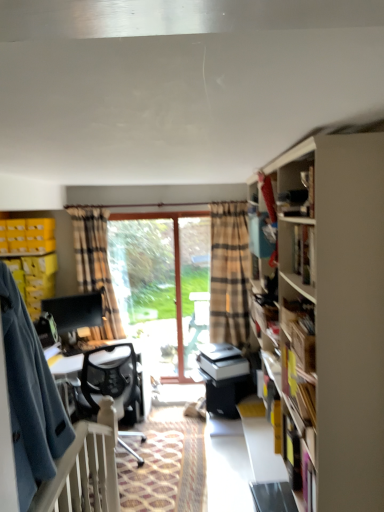
Question: Could you tell me if white plastic balustrade at lower left is facing matte black bookshelf at upper right?

Choices:
 (A) no
 (B) yes

Answer: (A)

Question: From a real-world perspective, does white plastic balustrade at lower left stand above matte black bookshelf at upper right?

Choices:
 (A) yes
 (B) no

Answer: (B)

Question: Does white plastic balustrade at lower left lie behind matte black bookshelf at upper right?

Choices:
 (A) no
 (B) yes

Answer: (A)

Question: From the image's perspective, is white plastic balustrade at lower left located beneath matte black bookshelf at upper right?

Choices:
 (A) no
 (B) yes

Answer: (B)

Question: Can you confirm if white plastic balustrade at lower left is taller than matte black bookshelf at upper right?

Choices:
 (A) no
 (B) yes

Answer: (B)

Question: Is white plastic balustrade at lower left bigger or smaller than white mesh chair at center?

Choices:
 (A) small
 (B) big

Answer: (A)

Question: In terms of width, does white plastic balustrade at lower left look wider or thinner when compared to white mesh chair at center?

Choices:
 (A) thin
 (B) wide

Answer: (A)

Question: Is white plastic balustrade at lower left taller or shorter than white mesh chair at center?

Choices:
 (A) short
 (B) tall

Answer: (A)

Question: From the image's perspective, is white plastic balustrade at lower left above or below white mesh chair at center?

Choices:
 (A) below
 (B) above

Answer: (B)

Question: Is plaid fabric curtain at center situated inside yellow plastic crate at left, the second cabinet ordered from the bottom, or outside?

Choices:
 (A) outside
 (B) inside

Answer: (A)

Question: From the image's perspective, is plaid fabric curtain at center located above or below yellow plastic crate at left, the second cabinet ordered from the bottom?

Choices:
 (A) above
 (B) below

Answer: (B)

Question: Considering the positions of plaid fabric curtain at center and yellow plastic crate at left, the second cabinet ordered from the bottom, in the image, is plaid fabric curtain at center wider or thinner than yellow plastic crate at left, the second cabinet ordered from the bottom,?

Choices:
 (A) thin
 (B) wide

Answer: (A)

Question: Considering the positions of plaid fabric curtain at center and yellow plastic crate at left, the second cabinet ordered from the bottom, in the image, is plaid fabric curtain at center taller or shorter than yellow plastic crate at left, the second cabinet ordered from the bottom,?

Choices:
 (A) short
 (B) tall

Answer: (B)

Question: Considering their positions, is yellow plastic crate at left, the second cabinet ordered from the bottom, located in front of or behind matte black bookshelf at upper right?

Choices:
 (A) front
 (B) behind

Answer: (B)

Question: Would you say yellow plastic crate at left, which ranks as the first cabinet in top-to-bottom order, is to the left or to the right of matte black bookshelf at upper right in the picture?

Choices:
 (A) right
 (B) left

Answer: (B)